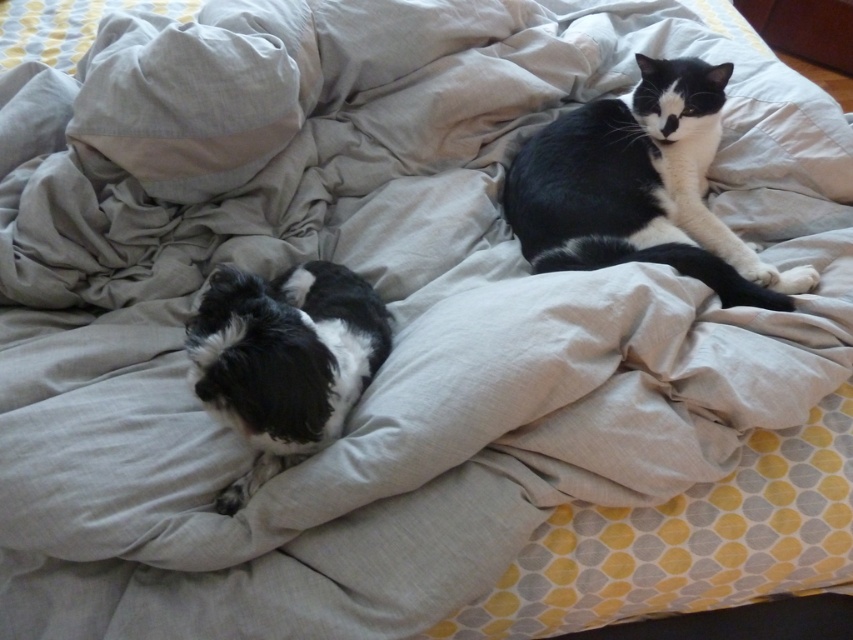
Question: Does black and white fur cat at upper right have a larger size compared to fluffy black-and-white dog at lower left?

Choices:
 (A) yes
 (B) no

Answer: (A)

Question: Is black and white fur cat at upper right wider than fluffy black-and-white dog at lower left?

Choices:
 (A) no
 (B) yes

Answer: (B)

Question: Can you confirm if black and white fur cat at upper right is positioned above fluffy black-and-white dog at lower left?

Choices:
 (A) no
 (B) yes

Answer: (B)

Question: Which object appears closest to the camera in this image?

Choices:
 (A) fluffy black-and-white dog at lower left
 (B) black and white fur cat at upper right

Answer: (A)